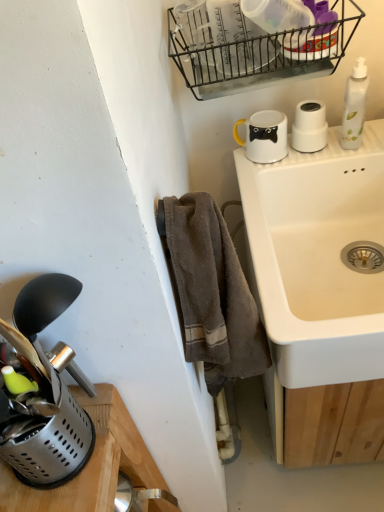
Where is `free space in front of white matte cup at upper right, marked as the 1th appliance in a top-to-bottom arrangement`? This screenshot has height=512, width=384. free space in front of white matte cup at upper right, marked as the 1th appliance in a top-to-bottom arrangement is located at coordinates (316, 161).